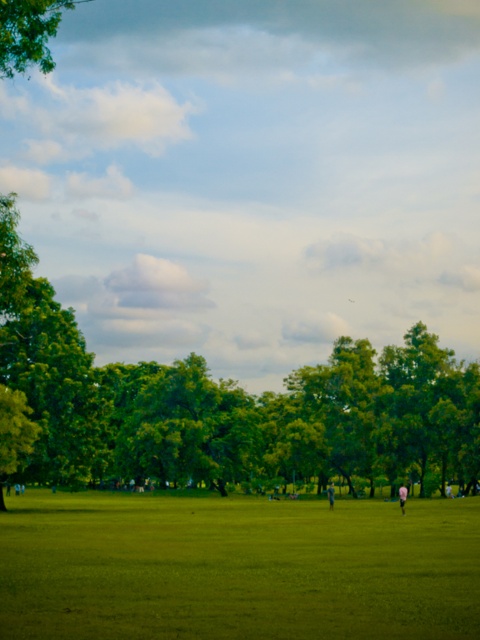
You are standing in the park and see a pink fabric person at center and a light blue cotton shirt at center. Which one is more to the right?

The pink fabric person at center is more to the right.

You are a photographer standing in the park and want to capture a photo where the green grassy field at center is visible above the light blue cotton shirt at center. Is this possible given their positions?

Yes, the green grassy field at center is positioned above the light blue cotton shirt at center, so the photographer can capture the grassy field above the shirt in the photo.

You are a photographer in the park. You want to capture a photo of the pink fabric person at center and the light blue cotton shirt at center. However, you notice that one of them is blocking the other. Which one is blocking the other?

The pink fabric person at center is positioned over light blue cotton shirt at center, so the pink fabric person at center is blocking the light blue cotton shirt at center.